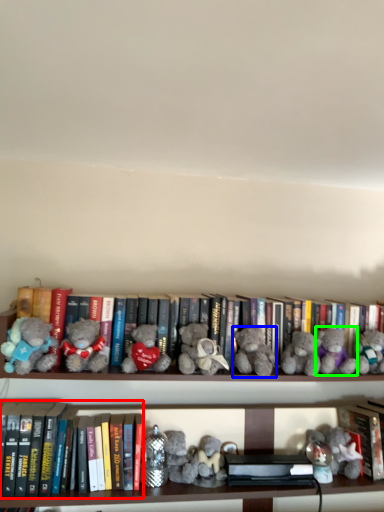
Question: Which is farther away from book (highlighted by a red box)? teddy bear (highlighted by a blue box) or teddy bear (highlighted by a green box)?

Choices:
 (A) teddy bear
 (B) teddy bear

Answer: (B)